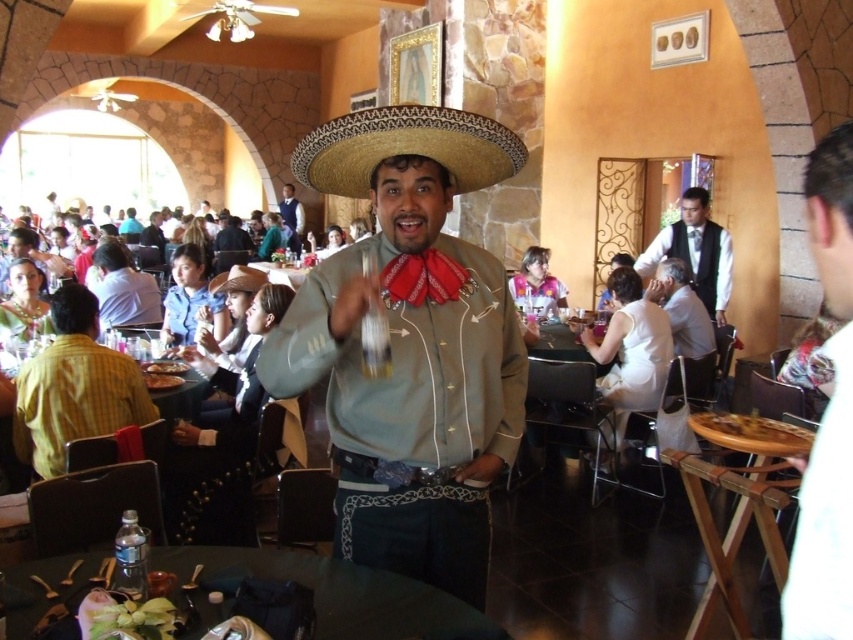
Question: Which of the following is the closest to the observer?

Choices:
 (A) smooth wooden plate at center
 (B) smooth black suit at center
 (C) white shirt at right
 (D) light blue shirt at center

Answer: (C)

Question: Is golden brown bread at table right closer to the viewer compared to brown felt cowboy hat at center?

Choices:
 (A) no
 (B) yes

Answer: (B)

Question: Considering the real-world distances, which object is closest to the white shirt at right?

Choices:
 (A) formal white shirt at center
 (B) wooden table at center

Answer: (B)

Question: Can you confirm if yellow checkered shirt at left is smaller than smooth black suit at center?

Choices:
 (A) no
 (B) yes

Answer: (B)

Question: Is formal white shirt at center smaller than golden brown bread at table right?

Choices:
 (A) yes
 (B) no

Answer: (B)

Question: Which object is positioned closest to the yellow checkered shirt at left?

Choices:
 (A) wooden table at center
 (B) brown felt cowboy hat at center
 (C) white shirt at right

Answer: (A)